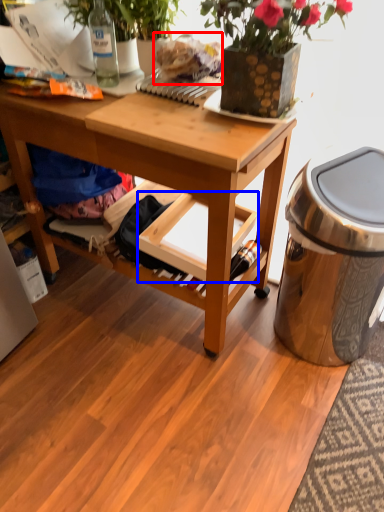
Question: Among these objects, which one is nearest to the camera, food (highlighted by a red box) or shelf (highlighted by a blue box)?

Choices:
 (A) food
 (B) shelf

Answer: (A)